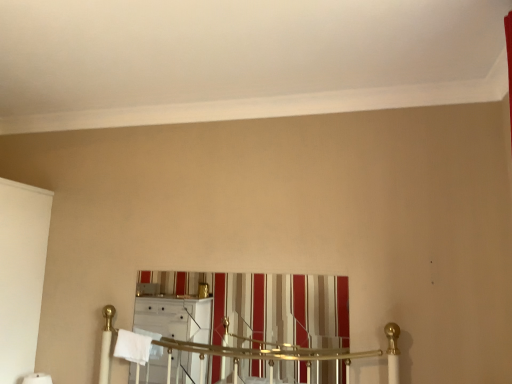
Question: Based on their sizes in the image, would you say white soft bath towel at center is bigger or smaller than striped fabric curtain at center?

Choices:
 (A) small
 (B) big

Answer: (A)

Question: Relative to striped fabric curtain at center, is white soft bath towel at center in front or behind?

Choices:
 (A) front
 (B) behind

Answer: (B)

Question: From the image's perspective, is white soft bath towel at center located above or below striped fabric curtain at center?

Choices:
 (A) above
 (B) below

Answer: (B)

Question: Considering the positions of striped fabric curtain at center and white soft bath towel at center in the image, is striped fabric curtain at center taller or shorter than white soft bath towel at center?

Choices:
 (A) short
 (B) tall

Answer: (B)

Question: Does point (252, 299) appear closer or farther from the camera than point (130, 342)?

Choices:
 (A) closer
 (B) farther

Answer: (A)

Question: Visually, is striped fabric curtain at center positioned to the left or to the right of white soft bath towel at center?

Choices:
 (A) right
 (B) left

Answer: (A)

Question: From a real-world perspective, is striped fabric curtain at center positioned above or below white soft bath towel at center?

Choices:
 (A) below
 (B) above

Answer: (B)